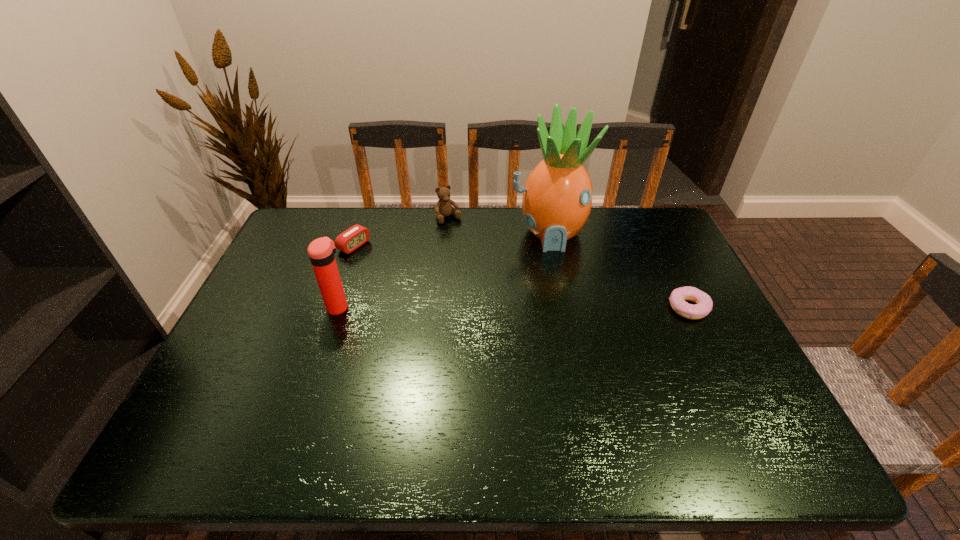
Locate an element on the screen. vacant space on the desktop that is between the second tallest object and the doughnut and is positioned at the entrance of the tallest object is located at coordinates (564, 308).

The height and width of the screenshot is (540, 960). I want to click on free space on the desktop that is between the fourth shortest object and the doughnut and is positioned on the front-facing side of the third object from left to right, so click(x=514, y=308).

Identify the location of free space on the desktop that is between the thermos bottle and the shortest object and is positioned on the front-facing side of the second shortest object. (479, 308).